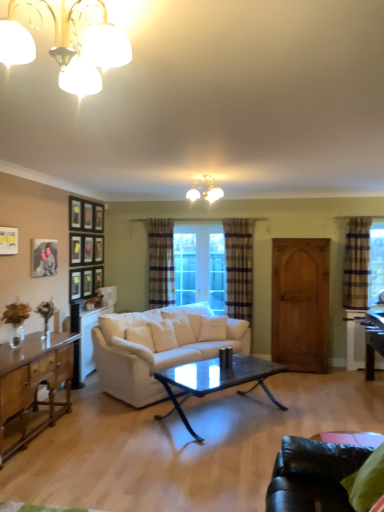
Question: Is the depth of white fabric pillow at center greater than that of matte black picture frame at upper left, the third picture frame from the right?

Choices:
 (A) yes
 (B) no

Answer: (A)

Question: From a real-world perspective, is white fabric pillow at center located higher than matte black picture frame at upper left, the third picture frame from the right?

Choices:
 (A) yes
 (B) no

Answer: (B)

Question: From the image's perspective, does white fabric pillow at center appear lower than matte black picture frame at upper left, the 3th picture frame when ordered from back to front?

Choices:
 (A) no
 (B) yes

Answer: (B)

Question: Can you confirm if white fabric pillow at center is thinner than matte black picture frame at upper left, which is the second picture frame in front-to-back order?

Choices:
 (A) yes
 (B) no

Answer: (B)

Question: Does white fabric pillow at center appear on the right side of matte black picture frame at upper left, which is the second picture frame in front-to-back order?

Choices:
 (A) no
 (B) yes

Answer: (B)

Question: Is white fabric pillow at center outside of matte black picture frame at upper left, which is the second picture frame in front-to-back order?

Choices:
 (A) yes
 (B) no

Answer: (A)

Question: From the image's perspective, is matte black picture frame at upper left, which is the 3th picture frame in left-to-right order, over white fabric pillow at center?

Choices:
 (A) yes
 (B) no

Answer: (A)

Question: Is matte black picture frame at upper left, the second picture frame when ordered from right to left, shorter than white fabric pillow at center?

Choices:
 (A) no
 (B) yes

Answer: (A)

Question: From a real-world perspective, is matte black picture frame at upper left, which appears as the fourth picture frame when viewed from the front, on top of white fabric pillow at center?

Choices:
 (A) yes
 (B) no

Answer: (A)

Question: From the image's perspective, is matte black picture frame at upper left, arranged as the first picture frame when viewed from the back, located beneath white fabric pillow at center?

Choices:
 (A) yes
 (B) no

Answer: (B)

Question: From a real-world perspective, is matte black picture frame at upper left, the second picture frame when ordered from right to left, below white fabric pillow at center?

Choices:
 (A) yes
 (B) no

Answer: (B)

Question: Considering the relative sizes of matte black picture frame at upper left, arranged as the first picture frame when viewed from the back, and white fabric pillow at center in the image provided, is matte black picture frame at upper left, arranged as the first picture frame when viewed from the back, wider than white fabric pillow at center?

Choices:
 (A) yes
 (B) no

Answer: (B)

Question: Are plaid fabric curtain at center, which is counted as the second curtain, starting from the front, and matte white chandelier at upper center, positioned as the second lamp in left-to-right order, far apart?

Choices:
 (A) yes
 (B) no

Answer: (A)